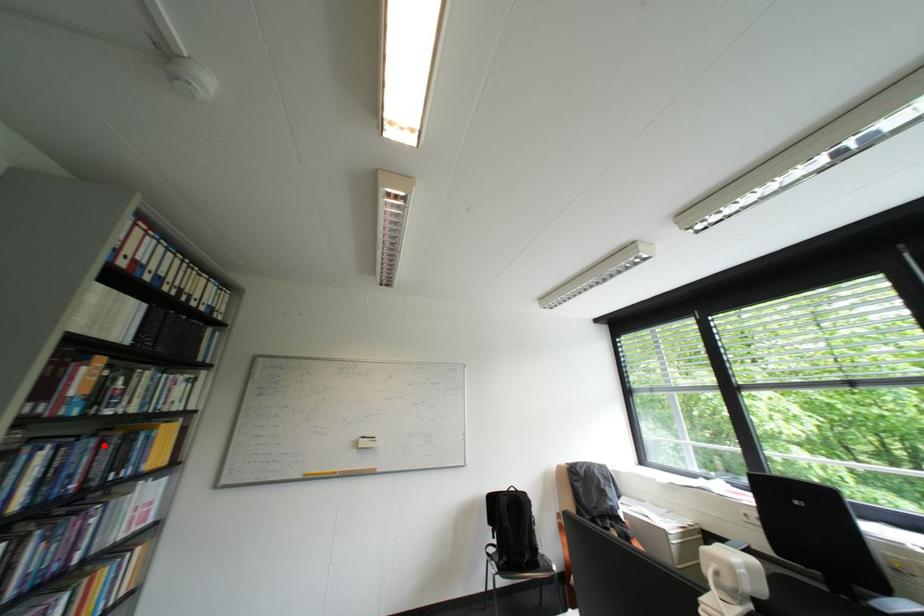
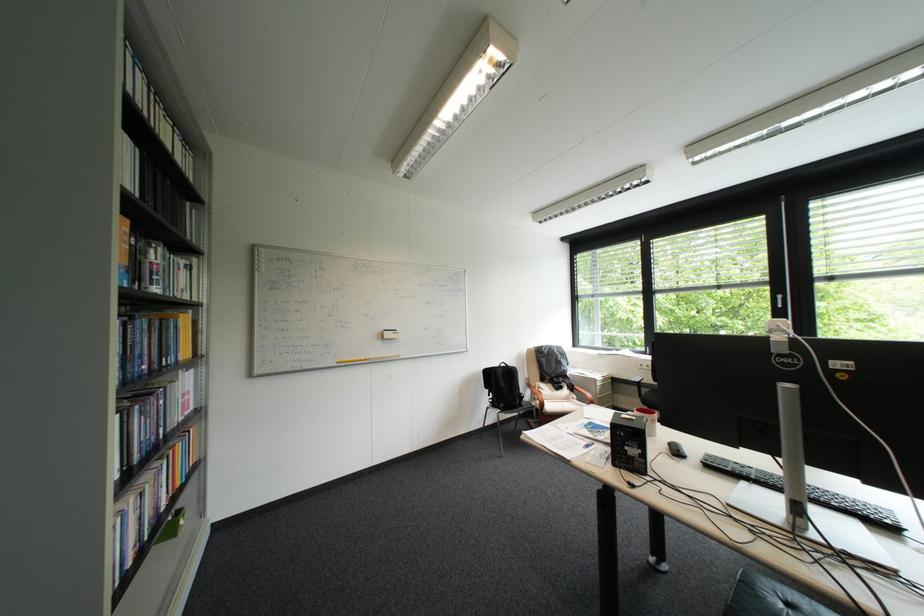
In the second image, find the point that corresponds to the highlighted location in the first image.

(159, 326)